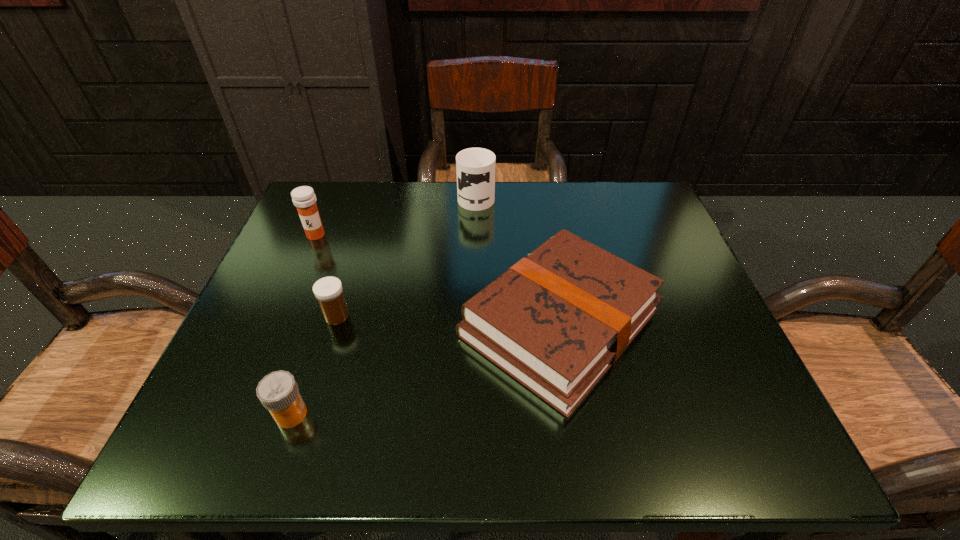
This screenshot has height=540, width=960. I want to click on mug that is at the far edge, so click(x=475, y=167).

Locate an element on the screen. The height and width of the screenshot is (540, 960). medicine that is at the far edge is located at coordinates (303, 197).

Where is `hardback book present at the near edge`? This screenshot has height=540, width=960. hardback book present at the near edge is located at coordinates (556, 321).

Locate an element on the screen. medicine at the near edge is located at coordinates (278, 392).

Where is `object that is at the right edge`? Image resolution: width=960 pixels, height=540 pixels. object that is at the right edge is located at coordinates (556, 321).

At what (x,y) coordinates should I click in order to perform the action: click on object at the far left corner. Please return your answer as a coordinate pair (x, y). Looking at the image, I should click on (303, 197).

At what (x,y) coordinates should I click in order to perform the action: click on object positioned at the near left corner. Please return your answer as a coordinate pair (x, y). The height and width of the screenshot is (540, 960). Looking at the image, I should click on (278, 392).

Locate an element on the screen. The width and height of the screenshot is (960, 540). object that is at the near right corner is located at coordinates (556, 321).

The height and width of the screenshot is (540, 960). What are the coordinates of `free space at the far edge of the desktop` in the screenshot? It's located at (558, 217).

You are a GUI agent. You are given a task and a screenshot of the screen. Output one action in this format:
    pyautogui.click(x=<x>, y=<y>)
    Task: Click on the vacant region at the near edge
    This screenshot has width=960, height=540.
    Given the screenshot: What is the action you would take?
    pyautogui.click(x=536, y=440)